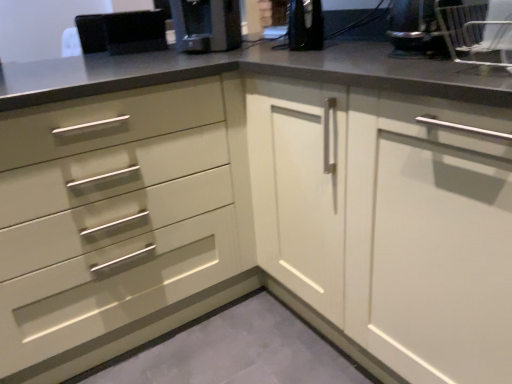
What do you see at coordinates (389, 222) in the screenshot?
I see `matte white cabinet at right` at bounding box center [389, 222].

Identify the location of black plastic bowl at upper right. Image resolution: width=512 pixels, height=384 pixels. (415, 29).

Based on the photo, is black plastic bowl at upper right in contact with matte white cabinet at right?

No, black plastic bowl at upper right is not in contact with matte white cabinet at right.

Is black plastic bowl at upper right looking in the opposite direction of matte white cabinet at right?

No, black plastic bowl at upper right is not facing the opposite direction of matte white cabinet at right.

Is black plastic bowl at upper right located outside matte white cabinet at right?

black plastic bowl at upper right is positioned outside matte white cabinet at right.

From the image's perspective, is black plastic bowl at upper right located above or below matte white cabinet at right?

Based on their image positions, black plastic bowl at upper right is located above matte white cabinet at right.

Can you confirm if black plastic bowl at upper right is positioned to the right of satin black coffee machine at upper center?

Yes.

Relative to satin black coffee machine at upper center, is black plastic bowl at upper right in front or behind?

In the image, black plastic bowl at upper right appears in front of satin black coffee machine at upper center.

From the image's perspective, is black plastic bowl at upper right on top of satin black coffee machine at upper center?

No.

The width and height of the screenshot is (512, 384). Find the location of `cabinetry below the satin black coffee machine at upper center (from the image's perspective)`. cabinetry below the satin black coffee machine at upper center (from the image's perspective) is located at coordinates (389, 222).

Are matte white cabinet at right and satin black coffee machine at upper center beside each other?

They are not placed beside each other.

Does matte white cabinet at right contain satin black coffee machine at upper center?

No.

From the image's perspective, which object appears higher, matte white cabinet at right or satin black coffee machine at upper center?

From the image's view, satin black coffee machine at upper center is above.

Is satin black coffee machine at upper center not close to black plastic bowl at upper right?

satin black coffee machine at upper center is near black plastic bowl at upper right, not far away.

Does satin black coffee machine at upper center contain black plastic bowl at upper right?

No, satin black coffee machine at upper center does not contain black plastic bowl at upper right.

Considering the positions of objects satin black coffee machine at upper center and black plastic bowl at upper right in the image provided, who is behind, satin black coffee machine at upper center or black plastic bowl at upper right?

satin black coffee machine at upper center.

Based on their positions, is satin black coffee machine at upper center located to the left or right of black plastic bowl at upper right?

satin black coffee machine at upper center is to the left of black plastic bowl at upper right.

Considering the positions of points (234, 17) and (504, 268), is point (234, 17) closer to camera compared to point (504, 268)?

No, (234, 17) is behind (504, 268).

From a real-world perspective, which is physically below, satin black coffee machine at upper center or matte white cabinet at right?

matte white cabinet at right is physically lower.

Choose the correct answer: Is satin black coffee machine at upper center inside matte white cabinet at right or outside it?

satin black coffee machine at upper center is located beyond the bounds of matte white cabinet at right.

Is matte white cabinet at right at the back of satin black coffee machine at upper center?

That's not correct — satin black coffee machine at upper center is not looking away from matte white cabinet at right.

Is the surface of matte white cabinet at right in direct contact with black plastic bowl at upper right?

No.

In the scene shown: Is matte white cabinet at right completely or partially outside of black plastic bowl at upper right?

Absolutely, matte white cabinet at right is external to black plastic bowl at upper right.

Between matte white cabinet at right and black plastic bowl at upper right, which one is positioned behind?

black plastic bowl at upper right is behind.

Looking at this image, is matte white cabinet at right turned away from black plastic bowl at upper right?

No, black plastic bowl at upper right is not at the back of matte white cabinet at right.

Locate an element on the screen. The image size is (512, 384). cabinetry below the black plastic bowl at upper right (from a real-world perspective) is located at coordinates (389, 222).

Find the location of a particular element. The width and height of the screenshot is (512, 384). appliance lying below the satin black coffee machine at upper center (from the image's perspective) is located at coordinates click(415, 29).

Based on their spatial positions, is matte white cabinet at right or black plastic bowl at upper right closer to satin black coffee machine at upper center?

matte white cabinet at right.

Looking at the image, which one is located closer to black plastic bowl at upper right, matte white cabinet at right or satin black coffee machine at upper center?

Among the two, matte white cabinet at right is located nearer to black plastic bowl at upper right.

Which object lies further to the anchor point satin black coffee machine at upper center, black plastic bowl at upper right or matte white cabinet at right?

black plastic bowl at upper right is positioned further to the anchor satin black coffee machine at upper center.

Based on their spatial positions, is satin black coffee machine at upper center or black plastic bowl at upper right closer to matte white cabinet at right?

black plastic bowl at upper right lies closer to matte white cabinet at right than the other object.

Based on their spatial positions, is satin black coffee machine at upper center or matte white cabinet at right closer to black plastic bowl at upper right?

matte white cabinet at right is closer to black plastic bowl at upper right.

From the image, which object appears to be nearer to matte white cabinet at right, black plastic bowl at upper right or satin black coffee machine at upper center?

black plastic bowl at upper right is positioned closer to the anchor matte white cabinet at right.

This screenshot has height=384, width=512. What are the coordinates of `appliance between matte white cabinet at right and satin black coffee machine at upper center from front to back` in the screenshot? It's located at (415, 29).